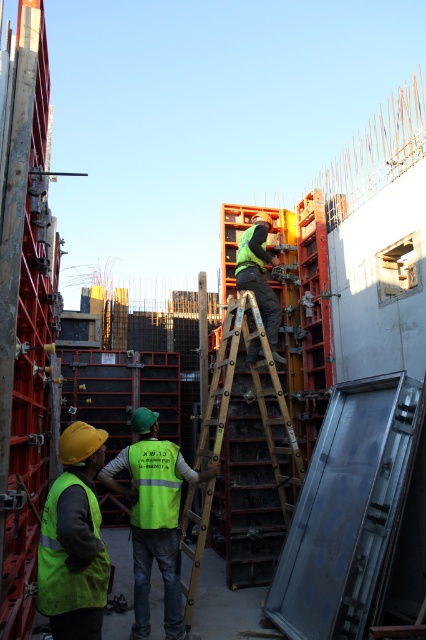
Question: Observing the image, what is the correct spatial positioning of wooden ladder at center in reference to yellow hard hat at lower left?

Choices:
 (A) below
 (B) above

Answer: (A)

Question: Considering the real-world distances, which object is farthest from the wooden ladder at center?

Choices:
 (A) high visibility yellow-green vest at center
 (B) green reflective vest at center
 (C) reflective yellow-green safety vest at lower left
 (D) yellow hard hat at lower left

Answer: (D)

Question: Does yellow hard hat at lower left have a smaller size compared to reflective yellow-green safety vest at lower left?

Choices:
 (A) no
 (B) yes

Answer: (A)

Question: Which of the following is the closest to the observer?

Choices:
 (A) high visibility yellow-green vest at center
 (B) wooden ladder at center
 (C) yellow hard hat at lower left

Answer: (C)

Question: Does yellow hard hat at lower left appear on the right side of reflective yellow-green safety vest at lower left?

Choices:
 (A) yes
 (B) no

Answer: (B)

Question: Which of these objects is positioned closest to the reflective yellow-green safety vest at lower left?

Choices:
 (A) high visibility yellow-green vest at center
 (B) yellow hard hat at lower left
 (C) green reflective vest at center

Answer: (A)